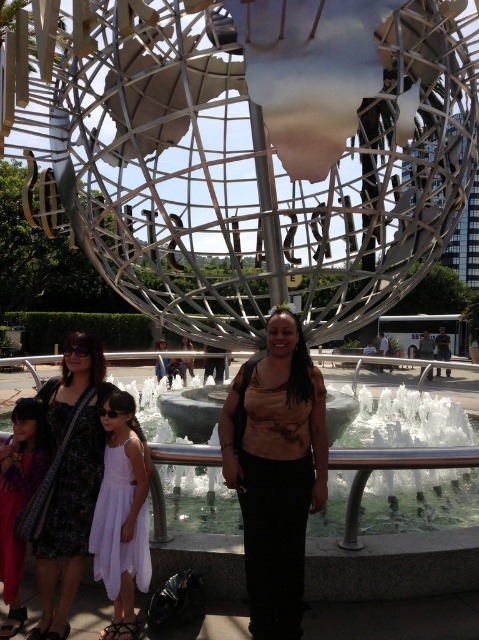
Can you confirm if brown matte shirt at center is smaller than dark floral dress at lower left?

Actually, brown matte shirt at center might be larger than dark floral dress at lower left.

Is brown matte shirt at center positioned before dark floral dress at lower left?

No, it is not.

Find the location of `brown matte shirt at center`. brown matte shirt at center is located at coordinates (275, 470).

Is brown matte shirt at center bigger than white chiffon dress at center?

Indeed, brown matte shirt at center has a larger size compared to white chiffon dress at center.

Find the location of a particular element. The width and height of the screenshot is (479, 640). brown matte shirt at center is located at coordinates (275, 470).

Can you confirm if dark floral dress at lower left is taller than white chiffon dress at center?

Yes.

Where is `dark floral dress at lower left`? The image size is (479, 640). dark floral dress at lower left is located at coordinates (67, 481).

Identify the location of dark floral dress at lower left. The height and width of the screenshot is (640, 479). (67, 481).

Image resolution: width=479 pixels, height=640 pixels. In order to click on dark floral dress at lower left in this screenshot , I will do `click(67, 481)`.